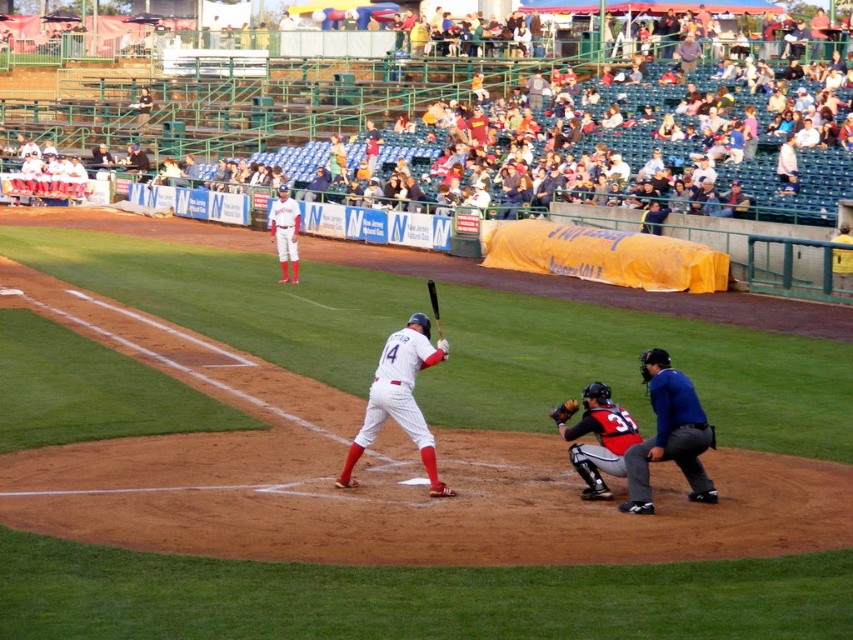
Question: Is blue fabric umpire at lower right above black leather catcher at lower right?

Choices:
 (A) yes
 (B) no

Answer: (A)

Question: Which point is farther to the camera?

Choices:
 (A) white uniform at center
 (B) orange leather glove at lower center
 (C) white matte baseball bat at center
 (D) white plastic seats at upper center

Answer: (D)

Question: Which of the following is the closest to the observer?

Choices:
 (A) orange leather glove at lower center
 (B) blue fabric umpire at lower right
 (C) white plastic seats at upper center
 (D) black matte bat at center

Answer: (D)

Question: Can you confirm if white plastic seats at upper center is smaller than orange leather glove at lower center?

Choices:
 (A) no
 (B) yes

Answer: (A)

Question: Which point is closer to the camera?

Choices:
 (A) black matte bat at center
 (B) orange leather glove at lower center
 (C) white matte baseball bat at center

Answer: (A)

Question: Is blue fabric umpire at lower right bigger than white matte baseball bat at center?

Choices:
 (A) no
 (B) yes

Answer: (A)